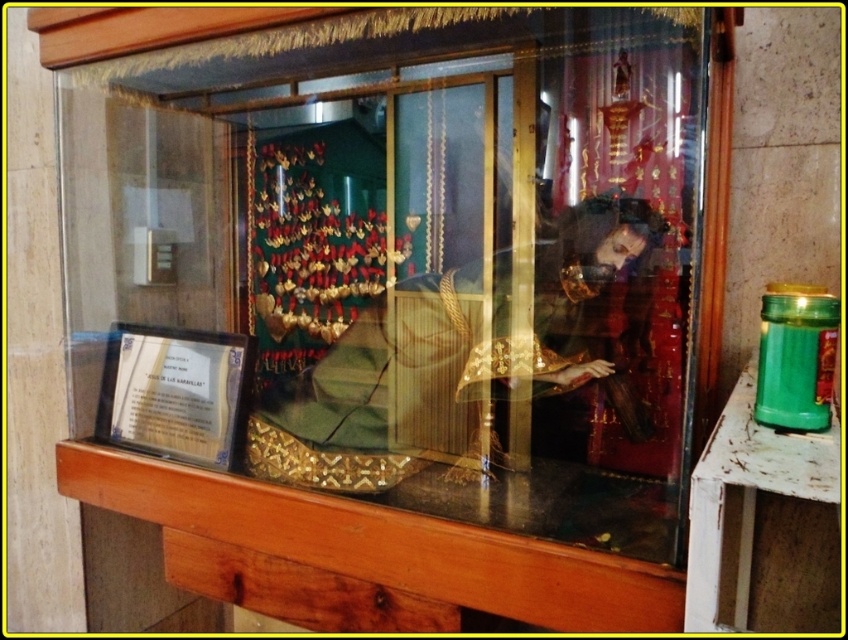
You are a visitor at a museum and want to take a photo of the transparent glass door at center and the matte glass display case at center. Which object should you focus on first to ensure the other is also in the frame?

The matte glass display case at center is positioned on the left side of transparent glass door at center, so you should focus on the transparent glass door at center first to ensure the matte glass display case at center is also in the frame.

You are a museum curator trying to clean the transparent glass door at center and the gold textured fabric at center inside the display case. Which object should you clean first if you want to start with the one closer to the front of the display case?

The transparent glass door at center is above the gold textured fabric at center, so it is closer to the front of the display case. You should clean the transparent glass door at center first.

You are standing in front of a display case containing a religious artifact. You notice a specific point at coordinates (402, 260). What object is located at that point?

The point at coordinates (402, 260) corresponds to the matte glass display case at center.